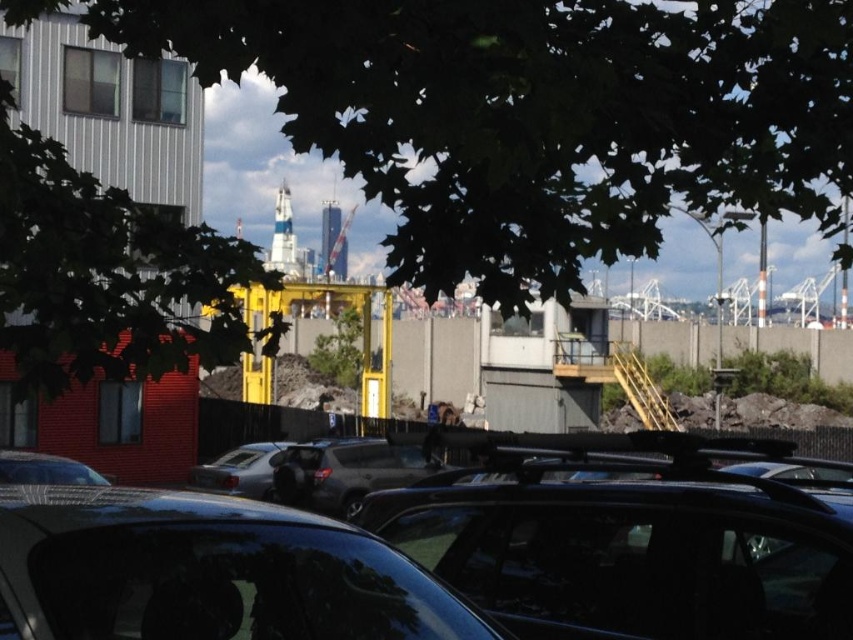
Is point (196, 630) positioned in front of point (416, 481)?

That is True.

Is point (86, 608) less distant than point (358, 500)?

Yes, it is.

The image size is (853, 640). I want to click on glossy black car at lower center, so click(206, 572).

Is point (612, 442) farther from camera compared to point (28, 371)?

That is False.

Who is positioned more to the left, glossy black car at center or green leafy tree at upper left?

green leafy tree at upper left is more to the left.

Locate an element on the screen. This screenshot has height=640, width=853. glossy black car at center is located at coordinates (630, 538).

Is glossy black car at center shorter than satin silver car at center?

Indeed, glossy black car at center has a lesser height compared to satin silver car at center.

Does glossy black car at center appear on the left side of satin silver car at center?

Incorrect, glossy black car at center is not on the left side of satin silver car at center.

Is point (670, 518) closer to camera compared to point (234, 490)?

Yes.

This screenshot has width=853, height=640. What are the coordinates of `glossy black car at center` in the screenshot? It's located at (630, 538).